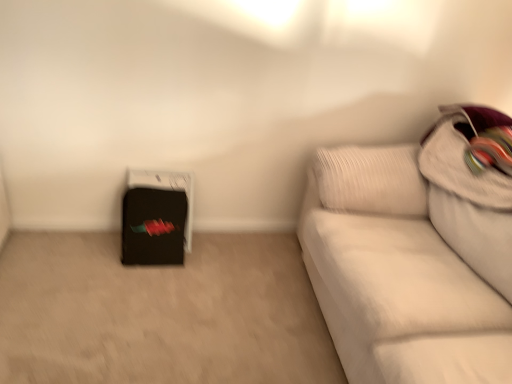
The image size is (512, 384). What are the coordinates of `black matte suitcase at lower left` in the screenshot? It's located at (153, 226).

What is the approximate width of black matte suitcase at lower left?

Answer: 9.62 inches.

You are a GUI agent. You are given a task and a screenshot of the screen. Output one action in this format:
    pyautogui.click(x=<x>, y=<y>)
    Task: Click on the white textured pillow at upper right
    
    Given the screenshot: What is the action you would take?
    pyautogui.click(x=464, y=157)

Which is behind, point (312, 251) or point (170, 212)?

The point (170, 212) is farther from the camera.

Looking at this image, what's the angular difference between white fabric couch at right and black matte suitcase at lower left's facing directions?

90.3 degrees.

Does white fabric couch at right appear on the left side of black matte suitcase at lower left?

No.

Who is bigger, white fabric couch at right or black matte suitcase at lower left?

white fabric couch at right.

From the image's perspective, would you say white textured pillow at upper right is positioned over black matte suitcase at lower left?

Yes, from the image's perspective, white textured pillow at upper right is over black matte suitcase at lower left.

I want to click on pillow on the right of black matte suitcase at lower left, so click(464, 157).

Is white textured pillow at upper right positioned with its back to black matte suitcase at lower left?

white textured pillow at upper right is not turned away from black matte suitcase at lower left.

Can you confirm if white textured pillow at upper right is bigger than black matte suitcase at lower left?

Correct, white textured pillow at upper right is larger in size than black matte suitcase at lower left.

From the image's perspective, which is below, black matte suitcase at lower left or white textured pillow at upper right?

black matte suitcase at lower left appears lower in the image.

Do you think black matte suitcase at lower left is within white textured pillow at upper right, or outside of it?

black matte suitcase at lower left exists outside the volume of white textured pillow at upper right.

This screenshot has height=384, width=512. In order to click on luggage behind the white textured pillow at upper right in this screenshot , I will do `click(153, 226)`.

Is black matte suitcase at lower left far away from white textured pillow at upper right?

black matte suitcase at lower left is far away from white textured pillow at upper right.

Does white fabric couch at right have a lesser width compared to white textured pillow at upper right?

No, white fabric couch at right is not thinner than white textured pillow at upper right.

Is white fabric couch at right located outside white textured pillow at upper right?

Absolutely, white fabric couch at right is external to white textured pillow at upper right.

How different are the orientations of white fabric couch at right and white textured pillow at upper right in degrees?

2.26e-05 degrees.

Can you confirm if white fabric couch at right is smaller than white textured pillow at upper right?

Incorrect, white fabric couch at right is not smaller in size than white textured pillow at upper right.

Which object is thinner, white textured pillow at upper right or white fabric couch at right?

With smaller width is white textured pillow at upper right.

Which object is more forward, white textured pillow at upper right or white fabric couch at right?

white fabric couch at right.

From the image's perspective, relative to white fabric couch at right, is white textured pillow at upper right above or below?

white textured pillow at upper right is situated higher than white fabric couch at right in the image.

Considering the relative sizes of white textured pillow at upper right and white fabric couch at right in the image provided, is white textured pillow at upper right taller than white fabric couch at right?

No, white textured pillow at upper right is not taller than white fabric couch at right.

Is black matte suitcase at lower left positioned with its back to white fabric couch at right?

That's not correct — black matte suitcase at lower left is not looking away from white fabric couch at right.

Does black matte suitcase at lower left have a greater height compared to white fabric couch at right?

No, black matte suitcase at lower left is not taller than white fabric couch at right.

In order to click on luggage below the white fabric couch at right (from a real-world perspective) in this screenshot , I will do `click(153, 226)`.

Where is `pillow on the right of black matte suitcase at lower left`? The height and width of the screenshot is (384, 512). pillow on the right of black matte suitcase at lower left is located at coordinates (464, 157).

Estimate the real-world distances between objects in this image. Which object is closer to black matte suitcase at lower left, white textured pillow at upper right or white fabric couch at right?

white fabric couch at right is closer to black matte suitcase at lower left.

Consider the image. Based on their spatial positions, is white fabric couch at right or black matte suitcase at lower left closer to white textured pillow at upper right?

white fabric couch at right lies closer to white textured pillow at upper right than the other object.

Looking at the image, which one is located closer to white fabric couch at right, white textured pillow at upper right or black matte suitcase at lower left?

The object closer to white fabric couch at right is white textured pillow at upper right.

From the picture: Considering their positions, is black matte suitcase at lower left positioned further to white textured pillow at upper right than white fabric couch at right?

black matte suitcase at lower left is positioned further to the anchor white textured pillow at upper right.

Based on their spatial positions, is white fabric couch at right or white textured pillow at upper right closer to black matte suitcase at lower left?

white fabric couch at right lies closer to black matte suitcase at lower left than the other object.

Based on the photo, estimate the real-world distances between objects in this image. Which object is further from white fabric couch at right, black matte suitcase at lower left or white textured pillow at upper right?

black matte suitcase at lower left.

At what (x,y) coordinates should I click in order to perform the action: click on studio couch between black matte suitcase at lower left and white textured pillow at upper right. Please return your answer as a coordinate pair (x, y). The width and height of the screenshot is (512, 384). Looking at the image, I should click on click(413, 257).